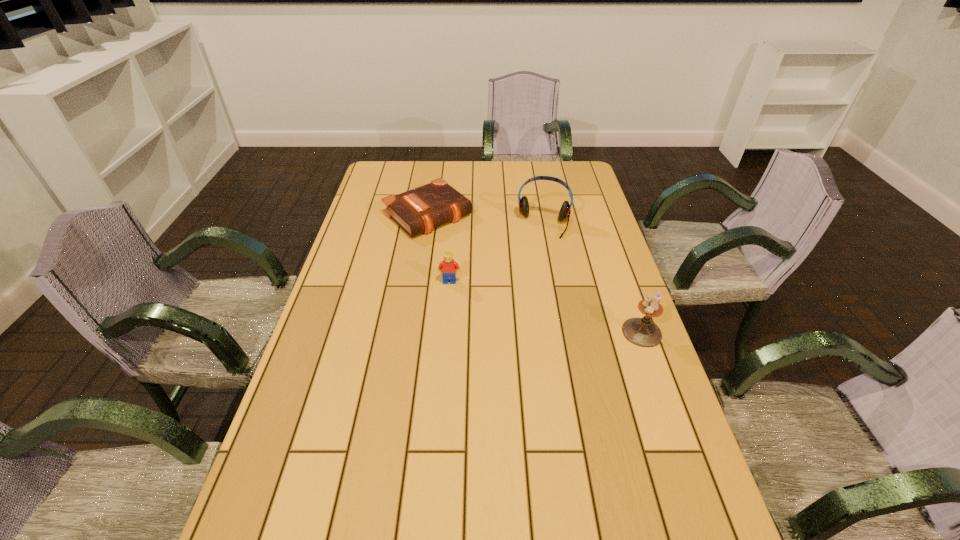
Find the location of a particular element. This screenshot has height=540, width=960. free space at the right edge is located at coordinates (600, 253).

The height and width of the screenshot is (540, 960). I want to click on vacant area that lies between the shortest object and the second nearest object, so click(x=439, y=248).

Locate an element on the screen. The width and height of the screenshot is (960, 540). free space between the nearest object and the second nearest object is located at coordinates (545, 307).

Where is `vacant space that is in between the third tallest object and the Bible`? The image size is (960, 540). vacant space that is in between the third tallest object and the Bible is located at coordinates (439, 248).

Locate an element on the screen. The width and height of the screenshot is (960, 540). vacant area between the third tallest object and the Bible is located at coordinates (439, 248).

Find the location of `free spot between the Lego and the second object from right to left`. free spot between the Lego and the second object from right to left is located at coordinates (497, 253).

I want to click on free space between the third tallest object and the candle holder, so click(x=545, y=307).

Where is `free spot between the shortest object and the third farthest object`? free spot between the shortest object and the third farthest object is located at coordinates (439, 248).

Image resolution: width=960 pixels, height=540 pixels. What are the coordinates of `vacant space that is in between the rightmost object and the headset` in the screenshot? It's located at (593, 279).

The height and width of the screenshot is (540, 960). I want to click on vacant area that lies between the rightmost object and the headset, so click(593, 279).